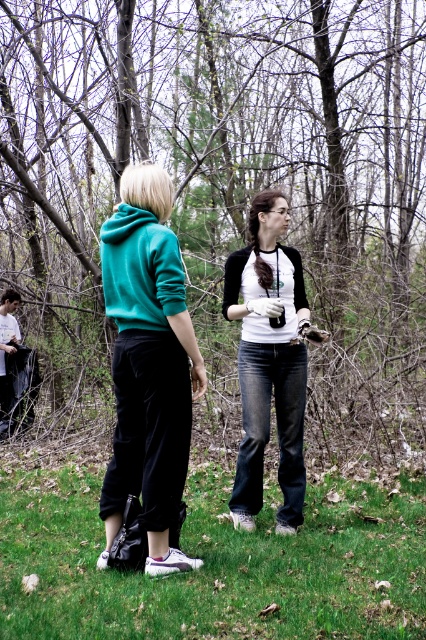
Does brown wood tree at center appear on the right side of teal fleece hoodie at center?

In fact, brown wood tree at center is to the left of teal fleece hoodie at center.

Identify the location of brown wood tree at center. (227, 177).

Is point (169, 192) closer to camera compared to point (301, 348)?

Yes, point (169, 192) is closer to viewer.

The image size is (426, 640). What are the coordinates of `teal fleece hoodie at center` in the screenshot? It's located at (149, 365).

Is white matte t-shirt at center thinner than teal fleece sweatshirt at left?

Incorrect, white matte t-shirt at center's width is not less than teal fleece sweatshirt at left's.

Measure the distance between point (229, 262) and camera.

Point (229, 262) and camera are 4.57 meters apart.

Find the location of `white matte t-shirt at center`. white matte t-shirt at center is located at coordinates (270, 360).